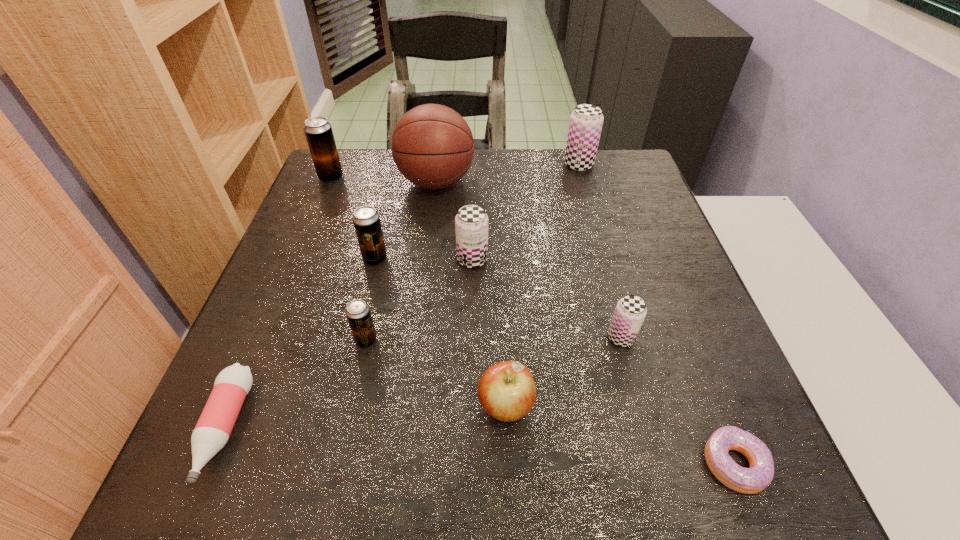
What are the coordinates of `free area in between the basketball and the farthest black beer can` in the screenshot? It's located at (384, 180).

The image size is (960, 540). In order to click on unoccupied position between the nearest black beer can and the nearest purple beer can in this screenshot , I will do `click(493, 339)`.

Identify the location of blank region between the basketball and the second biggest black beer can. (406, 220).

Locate an element on the screen. free area in between the smallest black beer can and the smallest purple beer can is located at coordinates (493, 339).

Locate an element on the screen. free area in between the smallest purple beer can and the rightmost object is located at coordinates (678, 400).

Image resolution: width=960 pixels, height=540 pixels. I want to click on free space between the basketball and the apple, so pyautogui.click(x=470, y=294).

Where is `free space between the biggest purple beer can and the nearest purple beer can`? This screenshot has height=540, width=960. free space between the biggest purple beer can and the nearest purple beer can is located at coordinates (600, 251).

Locate an element on the screen. Image resolution: width=960 pixels, height=540 pixels. free spot between the nearest black beer can and the purple doughnut is located at coordinates (550, 402).

Identify the location of vacant area between the fourth beer can from left to right and the second nearest black beer can. The height and width of the screenshot is (540, 960). (423, 259).

Choose which object is the second nearest neighbor to the second farthest black beer can. Please provide its 2D coordinates. Your answer should be formatted as a tuple, i.e. [(x, y)], where the tuple contains the x and y coordinates of a point satisfying the conditions above.

[(432, 145)]